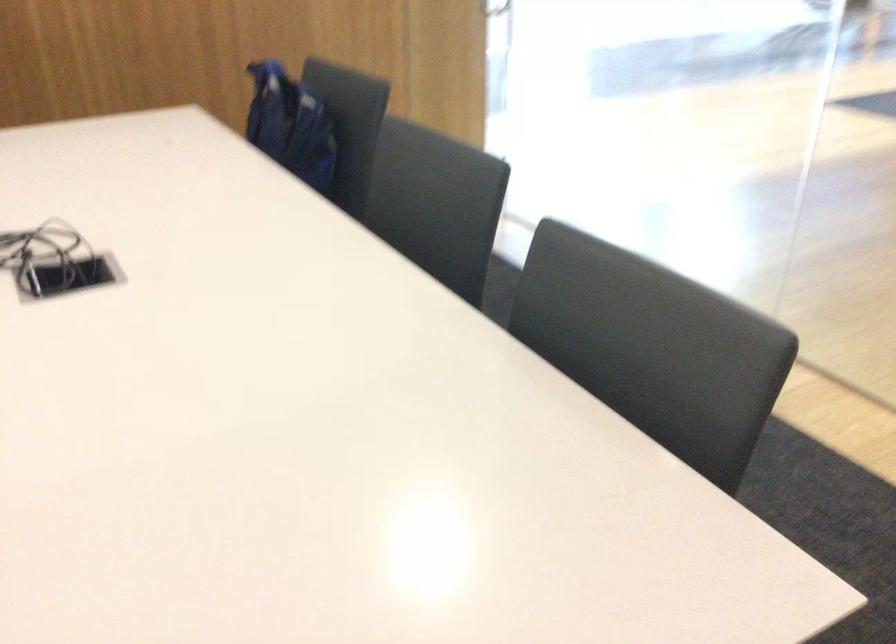
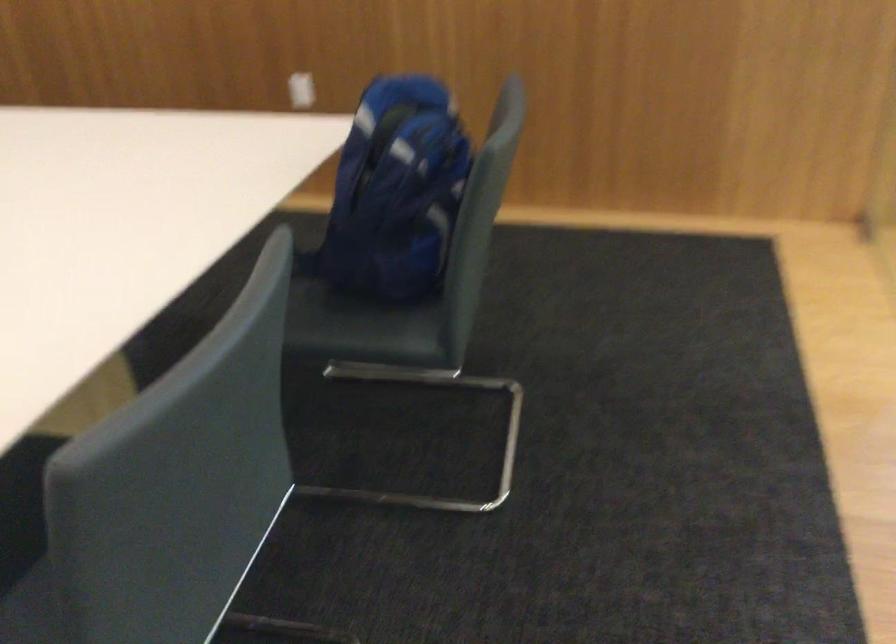
The point at [309,129] is marked in the first image. Where is the corresponding point in the second image?

(395, 192)